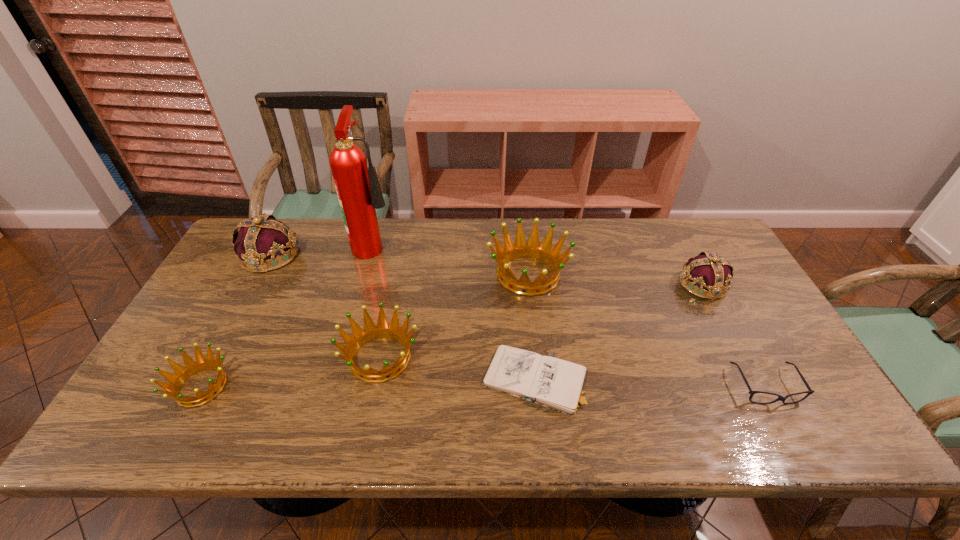
This screenshot has width=960, height=540. I want to click on vacant region between the third crown from right to left and the sixth tallest object, so click(x=291, y=372).

The image size is (960, 540). In order to click on free spot between the tallest crown and the sixth tallest object in this screenshot , I will do `click(236, 321)`.

At what (x,y) coordinates should I click in order to perform the action: click on free space that is in between the second smallest golden crown and the red fire extinguisher. Please return your answer as a coordinate pair (x, y). The width and height of the screenshot is (960, 540). Looking at the image, I should click on (377, 301).

The image size is (960, 540). I want to click on empty space that is in between the notebook and the second golden crown from left to right, so click(x=457, y=369).

I want to click on free space between the tallest object and the spectacles, so click(x=570, y=315).

Find the location of a particular element. This screenshot has height=540, width=960. object that is the fourth closest to the spectacles is located at coordinates (371, 332).

Identify the location of object that is the sixth closest to the second golden crown from left to right. (707, 271).

This screenshot has width=960, height=540. Identify the location of the closest crown to the second crown from right to left. (371, 332).

I want to click on crown object that ranks as the fourth closest to the notebook, so click(191, 367).

Identify the location of the closest golden crown relative to the right purple crown. This screenshot has height=540, width=960. (520, 248).